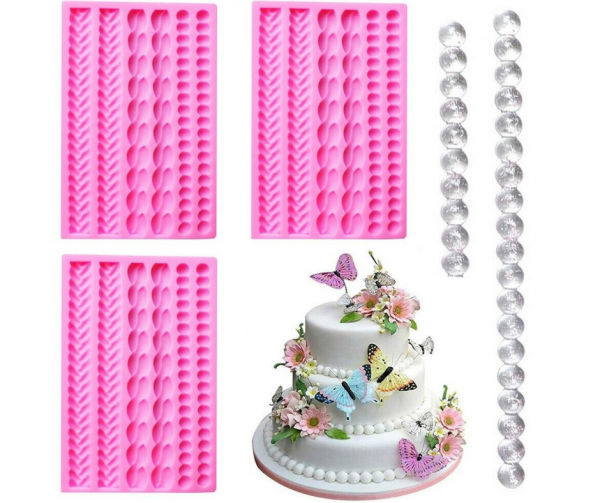
Identify the location of round decorations. The image size is (600, 503). (341, 476), (369, 430), (326, 368).